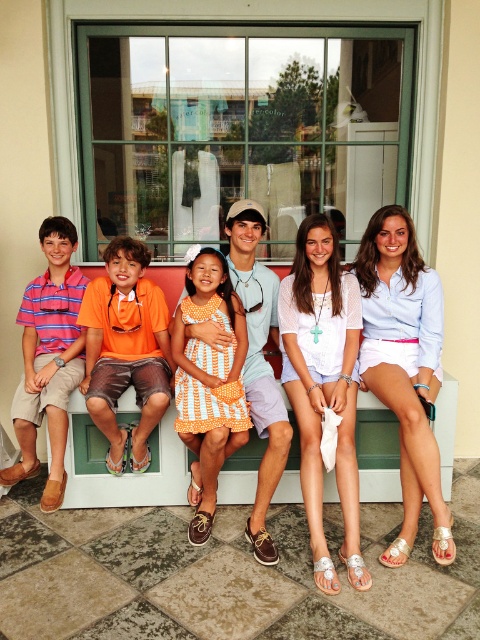
You are a tailor measuring the distance between two items in the image. The items are the white cotton dress at center and the orange fabric shorts at left. The tailor needs to ensure there is at least 12 inches between them for proper measurement. Is the current distance sufficient?

The white cotton dress at center and orange fabric shorts at left are 13.63 inches apart from each other, which is more than the required 12 inches. Therefore, the current distance is sufficient for the tailor to take proper measurements.

You are a store manager checking the seating arrangement. You see a customer in the striped cotton polo shirt at left and another in the light blue cotton shirt at center. Which customer is sitting to the right of the other?

The light blue cotton shirt at center is positioned on the right side of the striped cotton polo shirt at left, so the customer in the light blue cotton shirt at center is sitting to the right of the customer in the striped cotton polo shirt at left.